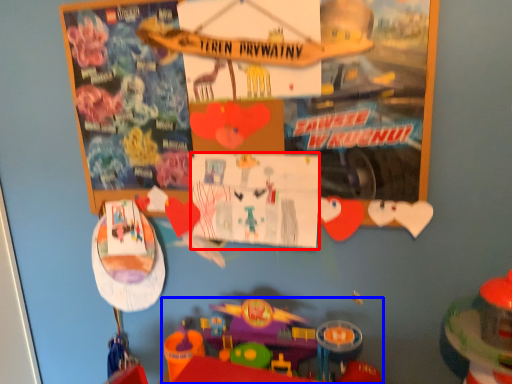
Question: Among these objects, which one is farthest to the camera, poster page (highlighted by a red box) or toy (highlighted by a blue box)?

Choices:
 (A) poster page
 (B) toy

Answer: (A)